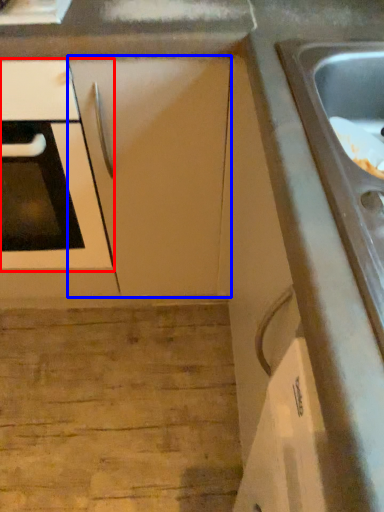
Question: Which point is further to the camera, oven (highlighted by a red box) or cabinetry (highlighted by a blue box)?

Choices:
 (A) oven
 (B) cabinetry

Answer: (B)